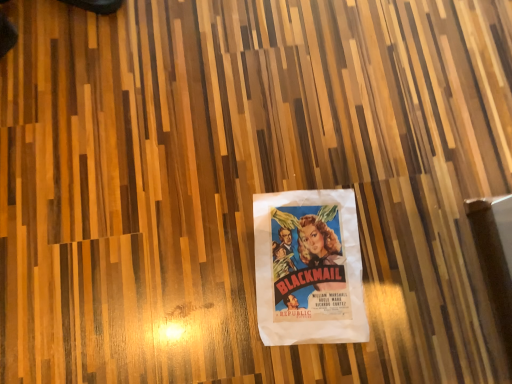
Question: Can you confirm if black leather shoe at upper left is shorter than white paper poster at center?

Choices:
 (A) yes
 (B) no

Answer: (B)

Question: From a real-world perspective, does black leather shoe at upper left sit lower than white paper poster at center?

Choices:
 (A) no
 (B) yes

Answer: (A)

Question: Does black leather shoe at upper left have a greater width compared to white paper poster at center?

Choices:
 (A) yes
 (B) no

Answer: (B)

Question: Does black leather shoe at upper left have a greater height compared to white paper poster at center?

Choices:
 (A) yes
 (B) no

Answer: (A)

Question: Can you confirm if black leather shoe at upper left is smaller than white paper poster at center?

Choices:
 (A) yes
 (B) no

Answer: (B)

Question: Is black leather shoe at upper left looking in the opposite direction of white paper poster at center?

Choices:
 (A) no
 (B) yes

Answer: (A)

Question: Could you tell me if white paper poster at center is facing black leather shoe at upper left?

Choices:
 (A) no
 (B) yes

Answer: (A)

Question: Can you confirm if white paper poster at center is thinner than black leather shoe at upper left?

Choices:
 (A) yes
 (B) no

Answer: (B)

Question: Can you confirm if white paper poster at center is smaller than black leather shoe at upper left?

Choices:
 (A) no
 (B) yes

Answer: (B)

Question: Considering the relative sizes of white paper poster at center and black leather shoe at upper left in the image provided, is white paper poster at center bigger than black leather shoe at upper left?

Choices:
 (A) yes
 (B) no

Answer: (B)

Question: From a real-world perspective, is white paper poster at center positioned under black leather shoe at upper left based on gravity?

Choices:
 (A) no
 (B) yes

Answer: (B)

Question: From the image's perspective, is white paper poster at center under black leather shoe at upper left?

Choices:
 (A) yes
 (B) no

Answer: (A)

Question: Considering the positions of black leather shoe at upper left and white paper poster at center in the image, is black leather shoe at upper left bigger or smaller than white paper poster at center?

Choices:
 (A) big
 (B) small

Answer: (A)